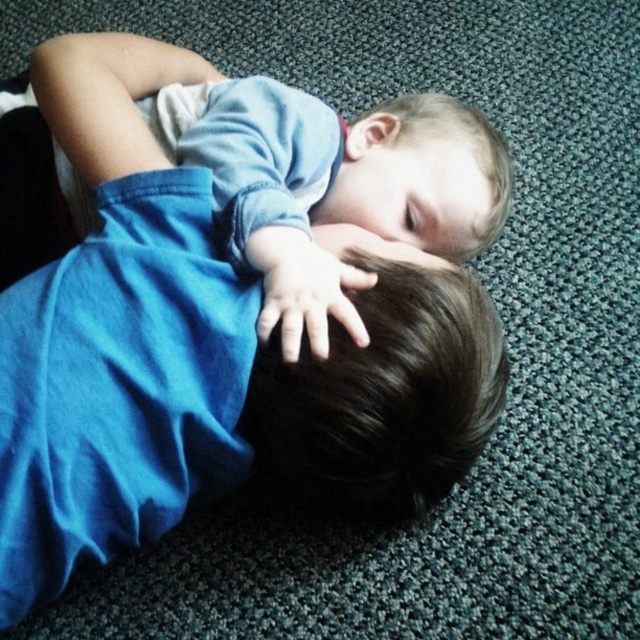
Looking at this image, you are a photographer trying to capture a candid shot of the two children in the scene. You need to ensure that both the blue denim shirt at upper center and the dark brown hair at center are in focus. Given that your camera has a depth of field that can cover 5 inches, will both subjects be in focus?

The blue denim shirt at upper center and dark brown hair at center are 5.77 inches apart. Since the distance between them exceeds the camera depth of field of 5 inches, they may not both be in focus simultaneously.

You are a photographer taking a picture of the two children lying on the carpet. You notice two specific points in the scene labeled as point (456, 112) and point (362, 497). Which of these points is closer to your camera lens?

Point (456, 112) is further to the camera than point (362, 497). Therefore, point (362, 497) is closer to the camera lens.

You are a photographer setting up a shoot in this scene. You need to place a small prop exactly halfway between the blue denim shirt at upper center and the dark brown hair at center. Based on their positions, where should you place the prop?

The prop should be placed to the right of the blue denim shirt at upper center and to the left of the dark brown hair at center, since the blue denim shirt at upper center is to the left of the dark brown hair at center.